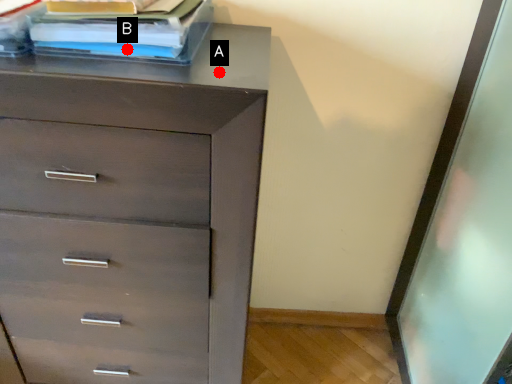
Question: Two points are circled on the image, labeled by A and B beside each circle. Which point appears farthest from the camera in this image?

Choices:
 (A) A is further
 (B) B is further

Answer: (B)